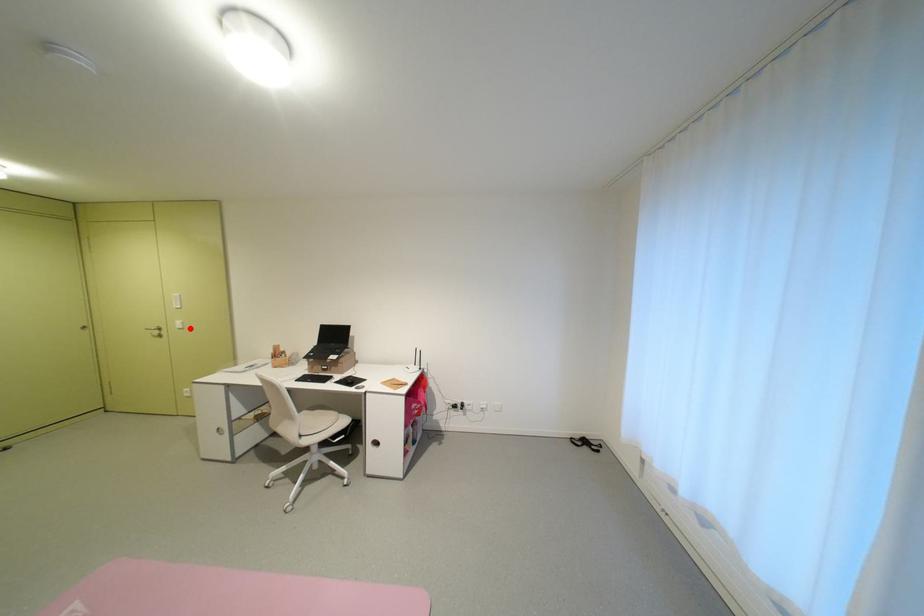
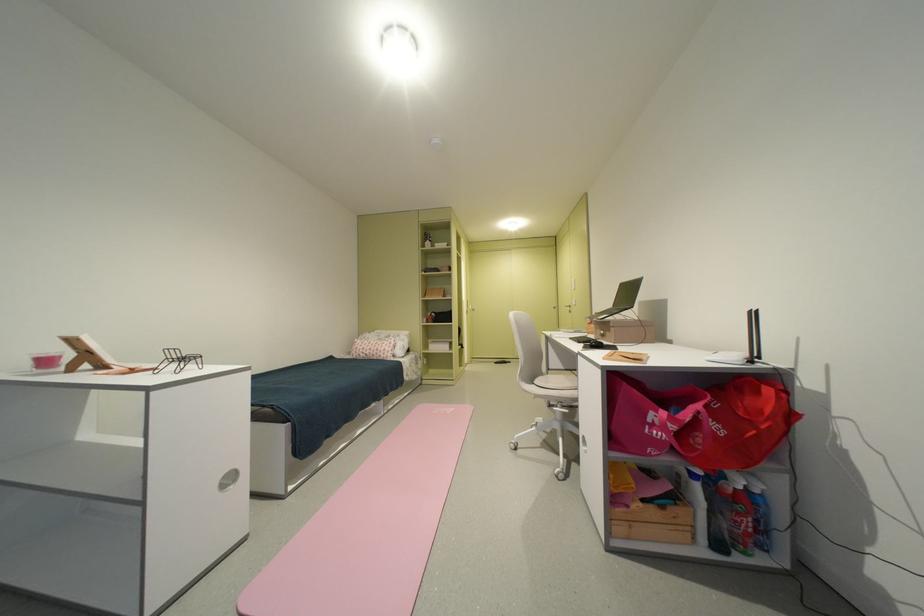
Find the pixel in the second image that matches the highlighted location in the first image.

(584, 305)